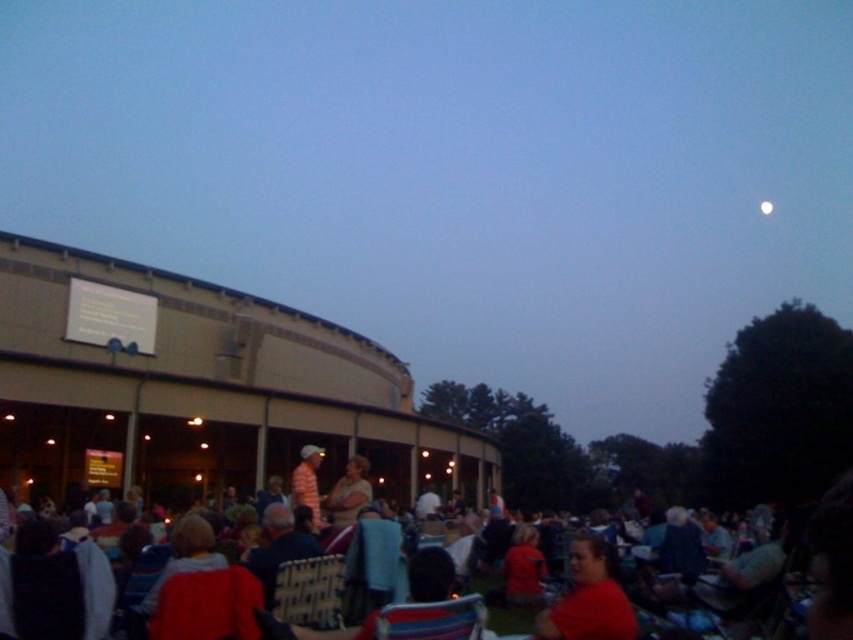
You are standing at the curved facade of the building and want to walk towards the point that is closer to the moon. Which point should you head towards, point (341, 513) or point (305, 456)?

Point (305, 456) is closer to the moon because it is behind point (341, 513), which is in front of it. Since the moon is in the upper right corner, the point further back would be closer to its position.

Consider the image. You are an astronomer observing the evening sky. You notice the striped cotton shirt at center and the white glossy moon at upper right. Which object is located more to the left in the scene?

The striped cotton shirt at center is positioned on the left side of the white glossy moon at upper right, so it is more to the left.

You are attending an outdoor event and notice two objects in the scene. One is the matte red shirt at center and the other is the white glossy moon at upper right. Which object appears taller in the image?

The matte red shirt at center appears taller than the white glossy moon at upper right in the image.